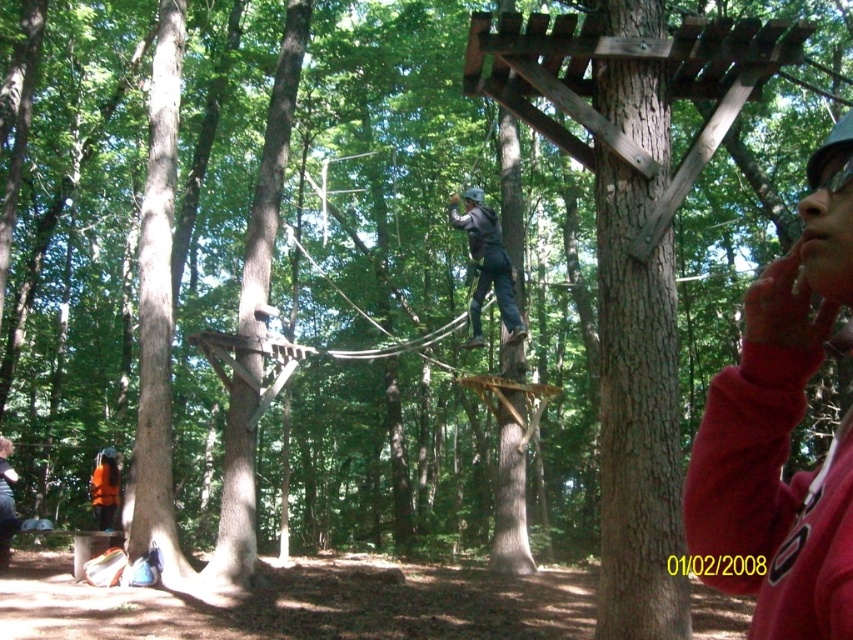
Which is in front, point (791, 628) or point (6, 467)?

Point (791, 628) is more forward.

The height and width of the screenshot is (640, 853). What do you see at coordinates (782, 428) in the screenshot?
I see `matte red sweatshirt at upper right` at bounding box center [782, 428].

The image size is (853, 640). Identify the location of matte red sweatshirt at upper right. (782, 428).

Image resolution: width=853 pixels, height=640 pixels. In order to click on matte red sweatshirt at upper right in this screenshot , I will do `click(782, 428)`.

Is the position of dark gray fabric harness at center less distant than that of orange life vest at lower left?

Yes, dark gray fabric harness at center is closer to the viewer.

Which is more to the right, dark gray fabric harness at center or orange life vest at lower left?

dark gray fabric harness at center

Is point (508, 314) farther from viewer compared to point (108, 515)?

No, (508, 314) is in front of (108, 515).

I want to click on dark gray fabric harness at center, so click(x=486, y=264).

Does dark gray fabric harness at center appear under orange fabric backpack at lower left?

Actually, dark gray fabric harness at center is above orange fabric backpack at lower left.

Between point (485, 250) and point (1, 465), which one is positioned in front?

Point (485, 250)

Identify the location of dark gray fabric harness at center. (486, 264).